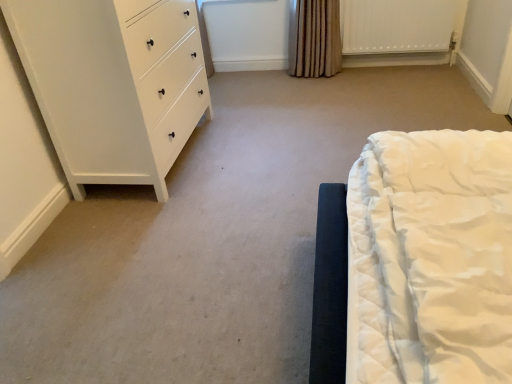
What is the approximate width of white textured radiator at upper right?

white textured radiator at upper right is 4.03 inches wide.

The width and height of the screenshot is (512, 384). I want to click on brown textured curtain at upper center, so click(314, 38).

This screenshot has height=384, width=512. In order to click on white matte chest of drawers at left in this screenshot , I will do `click(112, 84)`.

Find the location of a particular element. white textured radiator at upper right is located at coordinates (396, 26).

Is white matte chest of drawers at left facing away from white textured radiator at upper right?

No, white matte chest of drawers at left is not facing the opposite direction of white textured radiator at upper right.

Between point (24, 20) and point (433, 51), which one is positioned behind?

The point (433, 51) is more distant.

Identify the location of radiator below the white matte chest of drawers at left (from a real-world perspective). (396, 26).

Considering the positions of objects white matte chest of drawers at left and white textured radiator at upper right in the image provided, who is in front, white matte chest of drawers at left or white textured radiator at upper right?

white matte chest of drawers at left is in front.

Is the position of white matte chest of drawers at left more distant than that of brown textured curtain at upper center?

No, white matte chest of drawers at left is closer to the camera.

Considering the relative sizes of white matte chest of drawers at left and brown textured curtain at upper center in the image provided, is white matte chest of drawers at left taller than brown textured curtain at upper center?

Yes, white matte chest of drawers at left is taller than brown textured curtain at upper center.

Can brown textured curtain at upper center be found inside white matte chest of drawers at left?

No, brown textured curtain at upper center is not surrounded by white matte chest of drawers at left.

Would you say brown textured curtain at upper center is a long distance from white matte chest of drawers at left?

brown textured curtain at upper center is far away from white matte chest of drawers at left.

Can you tell me how much brown textured curtain at upper center and white matte chest of drawers at left differ in facing direction?

They differ by 87.6 degrees in their facing directions.

Is brown textured curtain at upper center situated inside white matte chest of drawers at left or outside?

brown textured curtain at upper center exists outside the volume of white matte chest of drawers at left.

Looking at this image, which is more to the right, brown textured curtain at upper center or white textured radiator at upper right?

Positioned to the right is white textured radiator at upper right.

How many degrees apart are the facing directions of brown textured curtain at upper center and white textured radiator at upper right?

The facing directions of brown textured curtain at upper center and white textured radiator at upper right are 3.16 degrees apart.

From a real-world perspective, between brown textured curtain at upper center and white textured radiator at upper right, who is vertically higher?

brown textured curtain at upper center.

Who is bigger, brown textured curtain at upper center or white textured radiator at upper right?

Bigger between the two is brown textured curtain at upper center.

Can you confirm if white textured radiator at upper right is positioned to the left of white matte chest of drawers at left?

No.

Is white textured radiator at upper right aimed at white matte chest of drawers at left?

No, white textured radiator at upper right is not turned towards white matte chest of drawers at left.

Between white textured radiator at upper right and white matte chest of drawers at left, which one has more height?

white matte chest of drawers at left.

Measure the distance from white textured radiator at upper right to white matte chest of drawers at left.

A distance of 5.97 feet exists between white textured radiator at upper right and white matte chest of drawers at left.

Measure the distance from white textured radiator at upper right to brown textured curtain at upper center.

The distance of white textured radiator at upper right from brown textured curtain at upper center is 13.75 inches.

Does point (410, 14) come behind point (310, 14)?

No, (410, 14) is in front of (310, 14).

From the image's perspective, is white textured radiator at upper right located above brown textured curtain at upper center?

Yes.

Who is bigger, white textured radiator at upper right or brown textured curtain at upper center?

With larger size is brown textured curtain at upper center.

Identify the location of radiator behind the white matte chest of drawers at left. (396, 26).

I want to click on curtain below the white matte chest of drawers at left (from a real-world perspective), so click(314, 38).

Which object lies further to the anchor point brown textured curtain at upper center, white matte chest of drawers at left or white textured radiator at upper right?

white matte chest of drawers at left.

When comparing their distances from brown textured curtain at upper center, does white textured radiator at upper right or white matte chest of drawers at left seem further?

white matte chest of drawers at left.

Considering their positions, is brown textured curtain at upper center positioned closer to white textured radiator at upper right than white matte chest of drawers at left?

The object closer to white textured radiator at upper right is brown textured curtain at upper center.

Considering their positions, is white textured radiator at upper right positioned further to white matte chest of drawers at left than brown textured curtain at upper center?

white textured radiator at upper right is positioned further to the anchor white matte chest of drawers at left.

Estimate the real-world distances between objects in this image. Which object is closer to white textured radiator at upper right, white matte chest of drawers at left or brown textured curtain at upper center?

brown textured curtain at upper center.

Estimate the real-world distances between objects in this image. Which object is closer to white matte chest of drawers at left, brown textured curtain at upper center or white textured radiator at upper right?

brown textured curtain at upper center.

The image size is (512, 384). I want to click on curtain between white matte chest of drawers at left and white textured radiator at upper right in the horizontal direction, so click(x=314, y=38).